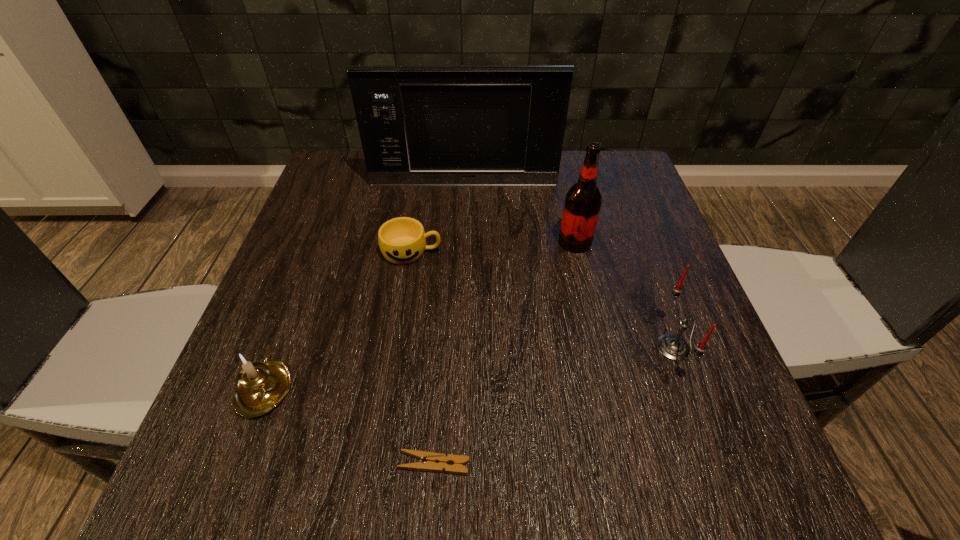
Where is `vacant space at the near right corner`? vacant space at the near right corner is located at coordinates (747, 492).

Locate an element on the screen. This screenshot has width=960, height=540. empty location between the candle holder and the shortest object is located at coordinates [x=349, y=425].

Identify the location of empty space between the shortest object and the candle. The image size is (960, 540). (554, 406).

Identify the location of free space that is in between the cup and the candle. This screenshot has width=960, height=540. (542, 300).

Where is `free space between the farthest object and the cup`? Image resolution: width=960 pixels, height=540 pixels. free space between the farthest object and the cup is located at coordinates (438, 218).

Identify the location of empty space that is in between the fourth shortest object and the fifth tallest object. The height and width of the screenshot is (540, 960). (542, 300).

Locate an element on the screen. This screenshot has height=540, width=960. blank region between the third tallest object and the candle holder is located at coordinates pyautogui.click(x=469, y=367).

Find the location of a particular element. This screenshot has height=540, width=960. vacant area that lies between the rightmost object and the shortest object is located at coordinates pos(554,406).

The image size is (960, 540). In order to click on free spot between the leftmost object and the shortest object in this screenshot , I will do `click(349, 425)`.

Locate an element on the screen. Image resolution: width=960 pixels, height=540 pixels. free space between the nearest object and the candle holder is located at coordinates (349, 425).